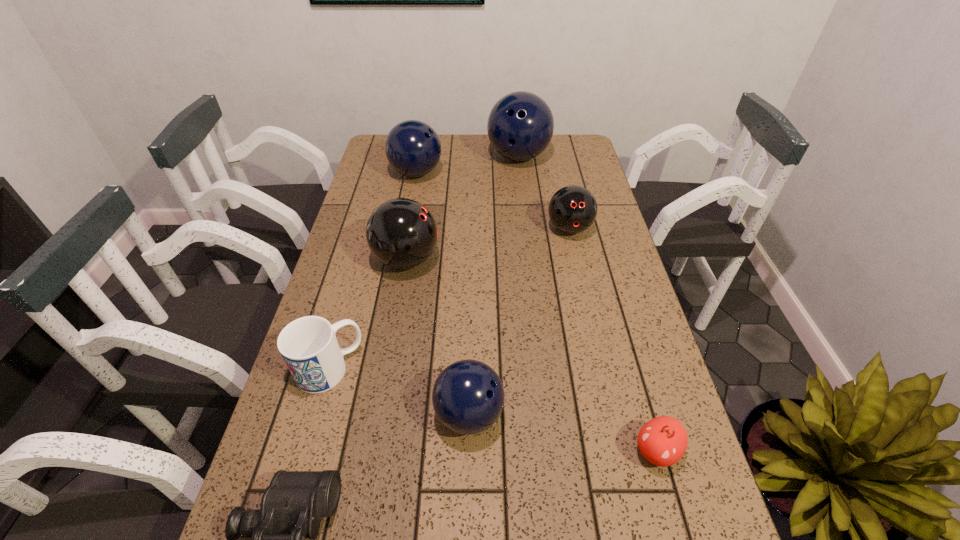
You are a GUI agent. You are given a task and a screenshot of the screen. Output one action in this format:
    pyautogui.click(x=<x>, y=<y>)
    Task: Click on the tallest bowling ball
    This screenshot has height=540, width=960.
    Given the screenshot: What is the action you would take?
    pyautogui.click(x=520, y=126)

At what (x,y) coordinates should I click in order to perform the action: click on the biggest blue bowling ball. Please return your answer as a coordinate pair (x, y). The width and height of the screenshot is (960, 540). Looking at the image, I should click on (520, 126).

You are a GUI agent. You are given a task and a screenshot of the screen. Output one action in this format:
    pyautogui.click(x=<x>, y=<y>)
    Task: Click on the second smallest blue bowling ball
    The width and height of the screenshot is (960, 540).
    Given the screenshot: What is the action you would take?
    [x=413, y=148]

In order to click on the bigger black bowling ball in this screenshot , I will do `click(401, 233)`.

Image resolution: width=960 pixels, height=540 pixels. Find the location of `the smaller black bowling ball`. the smaller black bowling ball is located at coordinates (572, 209).

Find the location of a particular element. Image resolution: width=960 pixels, height=540 pixels. the smallest blue bowling ball is located at coordinates (468, 397).

You are a GUI agent. You are given a task and a screenshot of the screen. Output one action in this format:
    pyautogui.click(x=<x>, y=<y>)
    Task: Click on the nearest bowling ball
    This screenshot has width=960, height=540.
    Given the screenshot: What is the action you would take?
    pyautogui.click(x=468, y=397)

Identify the location of blue mug. This screenshot has height=540, width=960. 308,345.

Find the location of a particular element. Image resolution: width=960 pixels, height=540 pixels. apple is located at coordinates pyautogui.click(x=662, y=441).

Find the location of a particular element. vacant space situated on the surface of the biggest blue bowling ball near the finger holes is located at coordinates (525, 214).